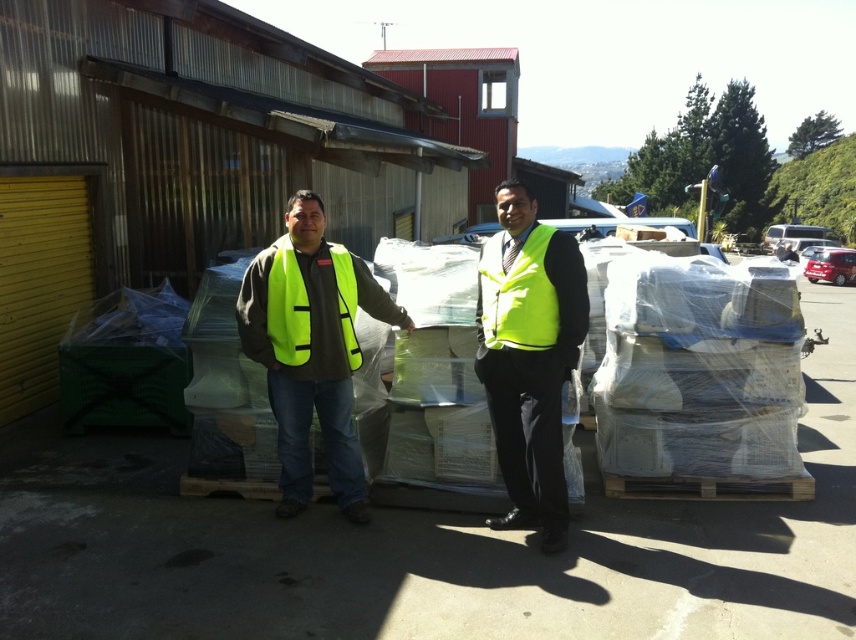
Between neon yellow vest at center and yellow reflective safety vest at center, which one is positioned higher?

yellow reflective safety vest at center

Can you confirm if neon yellow vest at center is wider than yellow reflective safety vest at center?

Indeed, neon yellow vest at center has a greater width compared to yellow reflective safety vest at center.

Describe the element at coordinates (528, 356) in the screenshot. I see `neon yellow vest at center` at that location.

You are a GUI agent. You are given a task and a screenshot of the screen. Output one action in this format:
    pyautogui.click(x=<x>, y=<y>)
    Task: Click on the neon yellow vest at center
    This screenshot has width=856, height=640.
    Given the screenshot: What is the action you would take?
    pyautogui.click(x=528, y=356)

Can you confirm if high visibility yellow vest at center is taller than neon yellow vest at center?

Incorrect, high visibility yellow vest at center's height is not larger of neon yellow vest at center's.

Between point (241, 337) and point (544, 536), which one is positioned in front?

Point (544, 536) is more forward.

Locate an element on the screen. The image size is (856, 640). high visibility yellow vest at center is located at coordinates (311, 349).

Does yellow reflective safety vest at center appear over yellow high-visibility vest at center?

Correct, yellow reflective safety vest at center is located above yellow high-visibility vest at center.

Does yellow reflective safety vest at center have a lesser width compared to yellow high-visibility vest at center?

Indeed, yellow reflective safety vest at center has a lesser width compared to yellow high-visibility vest at center.

Identify the location of yellow reflective safety vest at center. (516, 294).